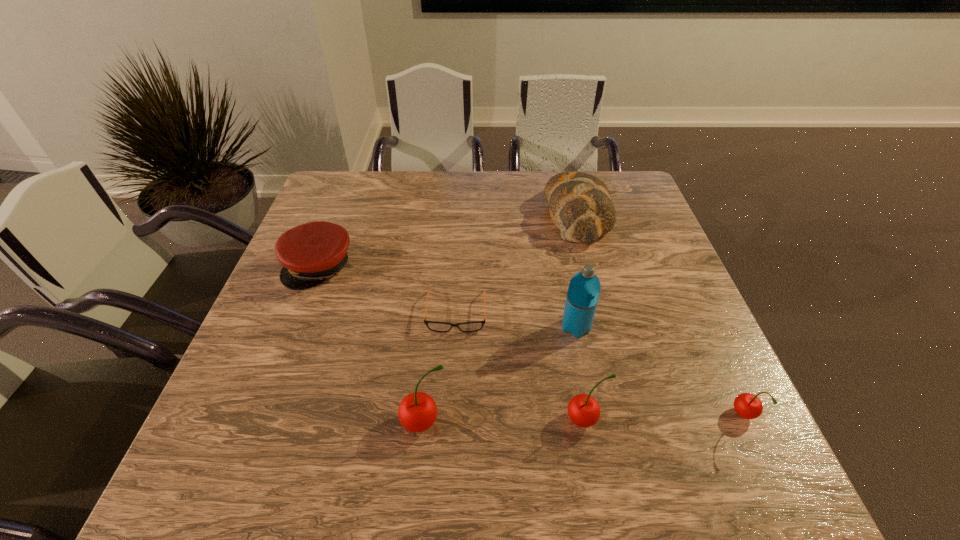
The image size is (960, 540). Identify the location of the leftmost cherry. (417, 412).

The width and height of the screenshot is (960, 540). I want to click on the second tallest object, so click(417, 412).

Find the location of a particular element. This screenshot has width=960, height=540. the second tallest cherry is located at coordinates (583, 410).

Locate an element on the screen. the rightmost object is located at coordinates (748, 406).

Locate an element on the screen. The image size is (960, 540). the rightmost cherry is located at coordinates (748, 406).

Locate an element on the screen. bread is located at coordinates (580, 204).

Image resolution: width=960 pixels, height=540 pixels. I want to click on the leftmost object, so click(x=311, y=253).

Where is `thermos bottle`? This screenshot has height=540, width=960. thermos bottle is located at coordinates (583, 293).

Where is `spectacles`? The image size is (960, 540). spectacles is located at coordinates (431, 325).

Locate an element on the screen. vacant region located on the back of the second tallest object is located at coordinates (432, 340).